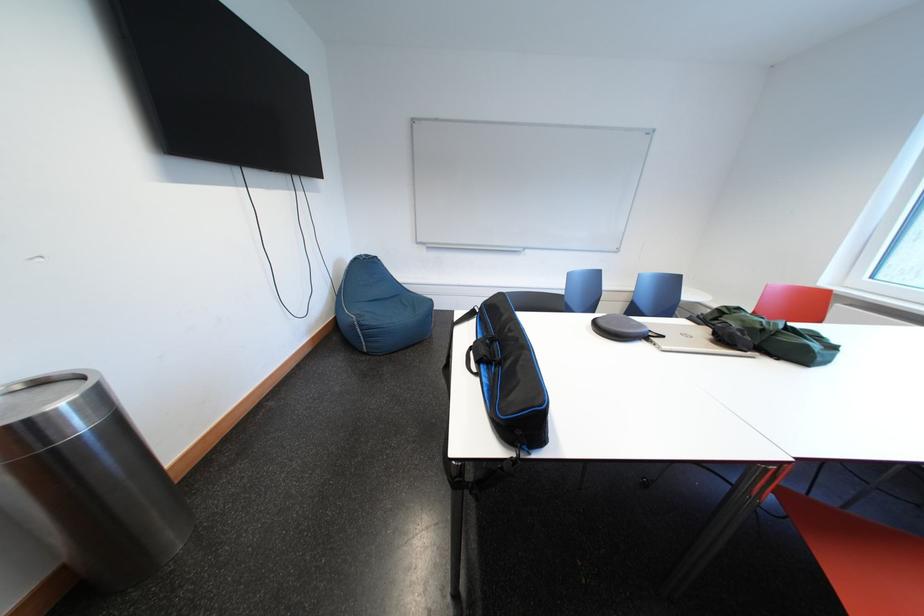
Find where to sit the red chair sitting surface. Please return your answer as a coordinate pair (x, y).

(859, 557)